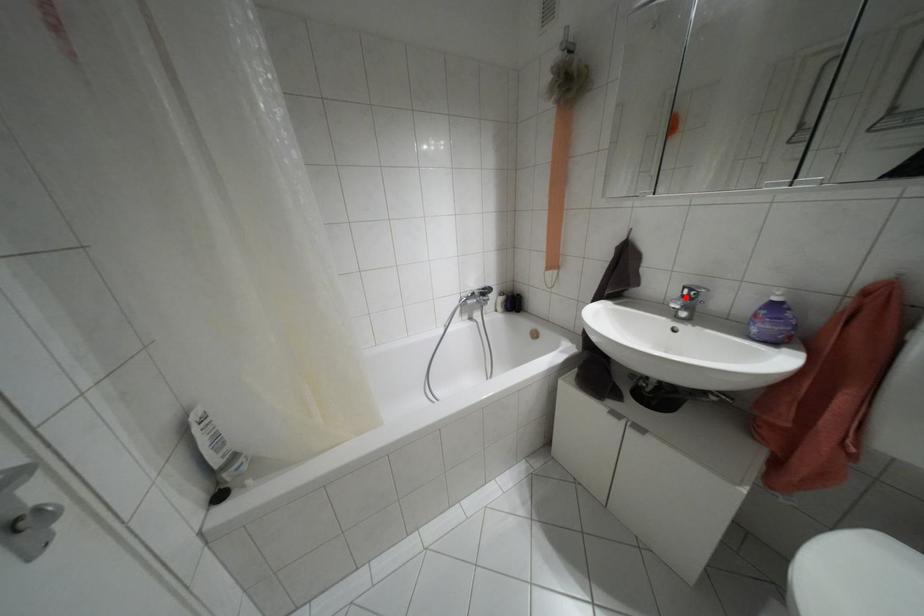
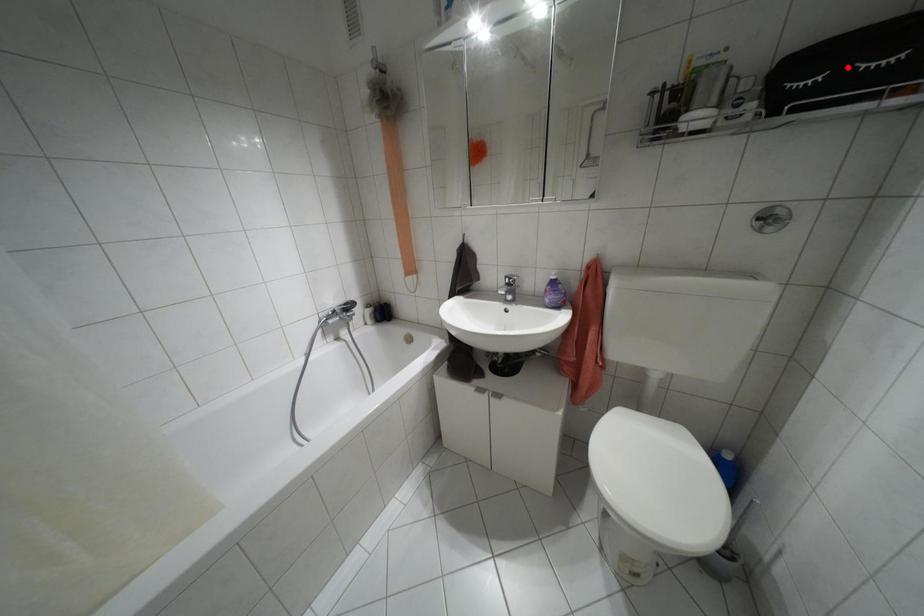
I am providing you with two images of the same scene from different viewpoints. A red point is marked on the first image and another point is marked on the second image. Is the marked point in image1 the same physical position as the marked point in image2?

No